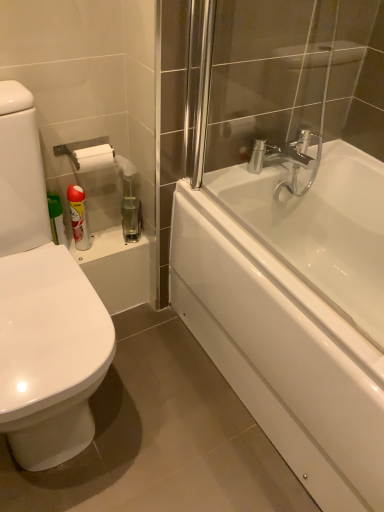
Find the location of a particular element. The height and width of the screenshot is (512, 384). free location to the right of white glossy can at upper left is located at coordinates (113, 242).